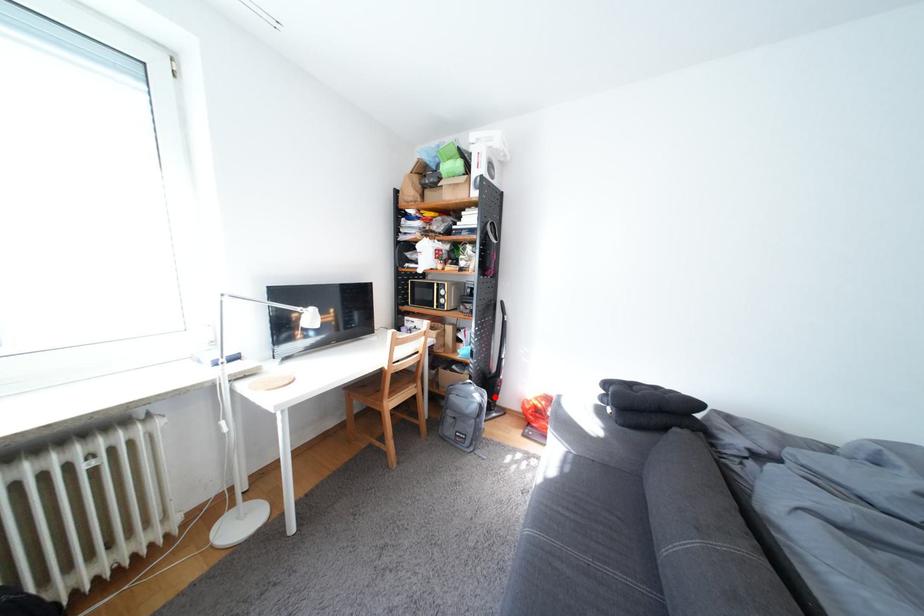
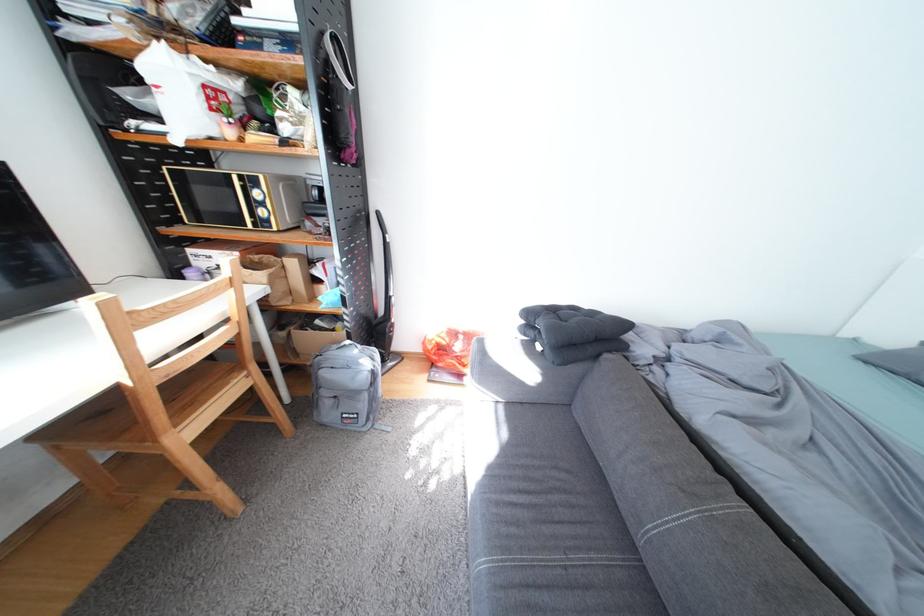
Question: I am providing you with two images of the same scene from different viewpoints. A red point is marked on the first image. Is the red point's position out of view in image 2?

Choices:
 (A) Yes
 (B) No

Answer: (B)